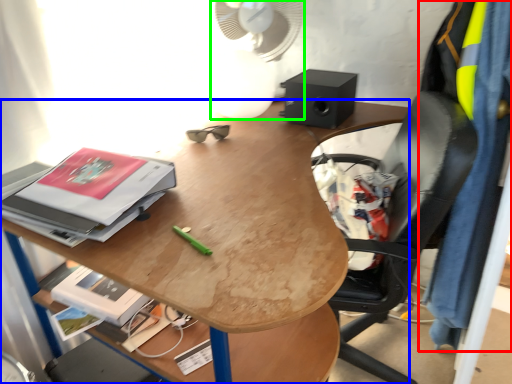
Question: Based on their relative distances, which object is farther from clothing (highlighted by a red box)? Choose from desk (highlighted by a blue box) and mechanical fan (highlighted by a green box).

Choices:
 (A) desk
 (B) mechanical fan

Answer: (B)